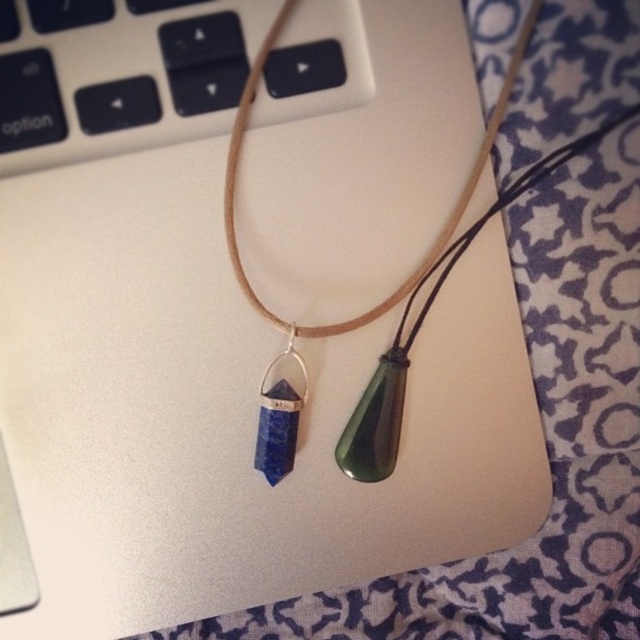
Is white plastic keyboard at upper left taller than green polished stone pendant at center?

No.

Based on the photo, is white plastic keyboard at upper left bigger than green polished stone pendant at center?

No, white plastic keyboard at upper left is not bigger than green polished stone pendant at center.

Identify the location of white plastic keyboard at upper left. This screenshot has height=640, width=640. (124, 76).

Where is `white plastic keyboard at upper left`? The height and width of the screenshot is (640, 640). white plastic keyboard at upper left is located at coordinates (124, 76).

Is white plastic keyboard at upper left bigger than lapis lazuli stone at center?

Indeed, white plastic keyboard at upper left has a larger size compared to lapis lazuli stone at center.

Is white plastic keyboard at upper left smaller than lapis lazuli stone at center?

No, white plastic keyboard at upper left is not smaller than lapis lazuli stone at center.

Measure the distance between point (72, 29) and camera.

Point (72, 29) is 34.29 inches from camera.

Identify the location of white plastic keyboard at upper left. The image size is (640, 640). (124, 76).

What do you see at coordinates (435, 237) in the screenshot? I see `green polished stone pendant at center` at bounding box center [435, 237].

Image resolution: width=640 pixels, height=640 pixels. Find the location of `green polished stone pendant at center`. green polished stone pendant at center is located at coordinates [435, 237].